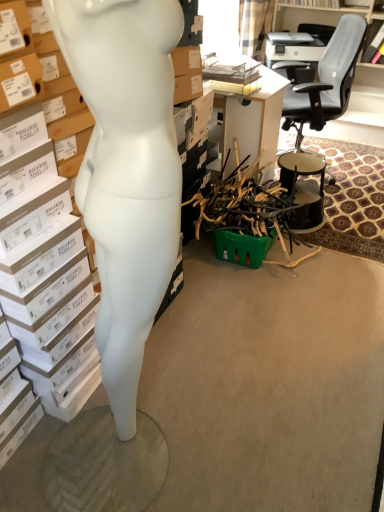
Question: From the image's perspective, would you say white cardboard box at left is shown under black glossy drum at right?

Choices:
 (A) yes
 (B) no

Answer: (A)

Question: Is white cardboard box at left oriented away from black glossy drum at right?

Choices:
 (A) yes
 (B) no

Answer: (B)

Question: Is white cardboard box at left located outside black glossy drum at right?

Choices:
 (A) no
 (B) yes

Answer: (B)

Question: Is white cardboard box at left not near black glossy drum at right?

Choices:
 (A) no
 (B) yes

Answer: (B)

Question: From the image's perspective, does white cardboard box at left appear higher than black glossy drum at right?

Choices:
 (A) no
 (B) yes

Answer: (A)

Question: Relative to black glossy drum at right, is white matte mannequin at left in front or behind?

Choices:
 (A) front
 (B) behind

Answer: (A)

Question: From the image's perspective, is white matte mannequin at left located above or below black glossy drum at right?

Choices:
 (A) below
 (B) above

Answer: (A)

Question: Considering the positions of point (170, 258) and point (299, 226), is point (170, 258) closer or farther from the camera than point (299, 226)?

Choices:
 (A) closer
 (B) farther

Answer: (A)

Question: In terms of height, does white matte mannequin at left look taller or shorter compared to black glossy drum at right?

Choices:
 (A) short
 (B) tall

Answer: (B)

Question: From the image's perspective, is black leather office chair at upper right located above or below white matte mannequin at left?

Choices:
 (A) above
 (B) below

Answer: (A)

Question: In the image, is black leather office chair at upper right positioned in front of or behind white matte mannequin at left?

Choices:
 (A) behind
 (B) front

Answer: (A)

Question: From a real-world perspective, relative to white matte mannequin at left, is black leather office chair at upper right vertically above or below?

Choices:
 (A) below
 (B) above

Answer: (A)

Question: Is black leather office chair at upper right wider or thinner than white matte mannequin at left?

Choices:
 (A) thin
 (B) wide

Answer: (B)

Question: Based on their positions, is white cardboard box at left located to the left or right of white matte mannequin at left?

Choices:
 (A) right
 (B) left

Answer: (B)

Question: From their relative heights in the image, would you say white cardboard box at left is taller or shorter than white matte mannequin at left?

Choices:
 (A) short
 (B) tall

Answer: (A)